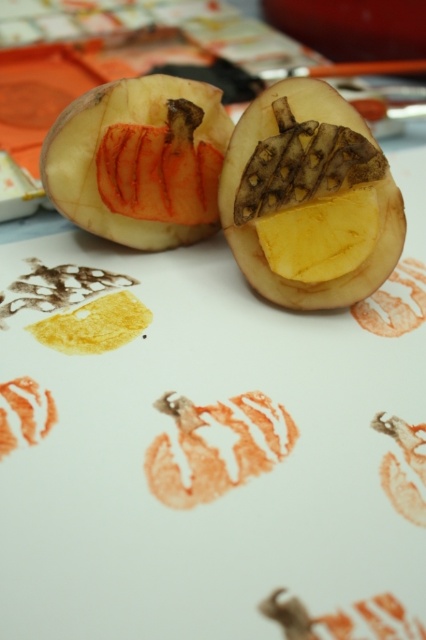
Question: Can you confirm if matte orange flesh at center is positioned to the left of brown textured potato at center?

Choices:
 (A) yes
 (B) no

Answer: (A)

Question: Considering the relative positions of orange rubber stamp at center and orange rubber stamp at lower left in the image provided, where is orange rubber stamp at center located with respect to orange rubber stamp at lower left?

Choices:
 (A) left
 (B) right

Answer: (B)

Question: Which point is farther to the camera?

Choices:
 (A) orange rubber stamp at lower left
 (B) matte orange flesh at center

Answer: (B)

Question: Does orange rubber stamp at center have a greater width compared to brown textured potato at center?

Choices:
 (A) yes
 (B) no

Answer: (A)

Question: Which of the following is the farthest from the observer?

Choices:
 (A) brown textured potato at center
 (B) yellow matte potato at center

Answer: (B)

Question: Which of the following is the closest to the observer?

Choices:
 (A) orange rubber stamp at center
 (B) orange rubber stamp at lower left
 (C) matte orange flesh at center

Answer: (A)